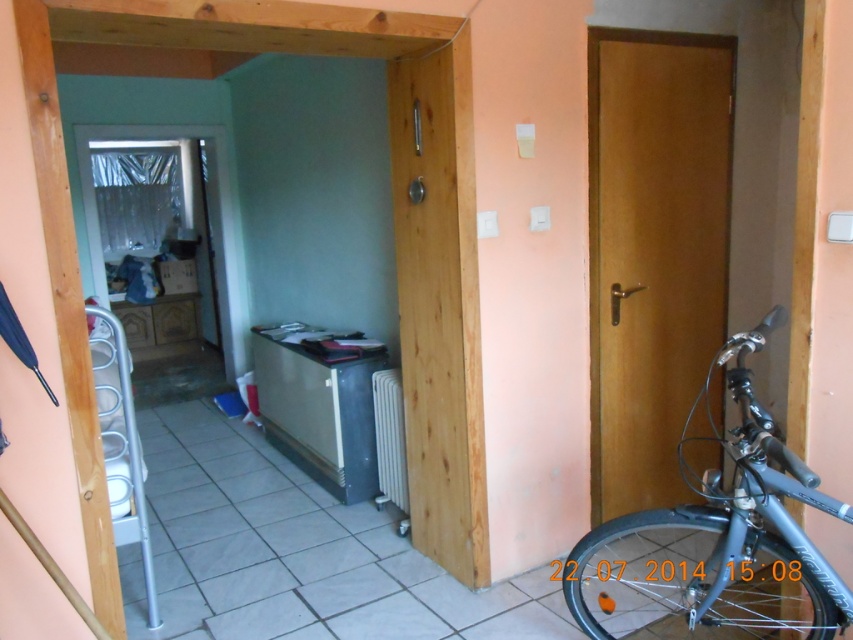
Question: Which object appears farthest from the camera in this image?

Choices:
 (A) wooden door at center
 (B) wooden door at right
 (C) silver metallic bicycle at right

Answer: (B)

Question: Is wooden door at right thinner than wooden door at center?

Choices:
 (A) yes
 (B) no

Answer: (B)

Question: Which object appears farthest from the camera in this image?

Choices:
 (A) wooden door at center
 (B) wooden door at right
 (C) silver metallic bicycle at right

Answer: (B)

Question: Does wooden door at right have a smaller size compared to wooden door at center?

Choices:
 (A) yes
 (B) no

Answer: (B)

Question: Where is wooden door at right located in relation to wooden door at center in the image?

Choices:
 (A) below
 (B) above

Answer: (B)

Question: Which point is farther from the camera taking this photo?

Choices:
 (A) (454, 113)
 (B) (662, 81)
 (C) (759, 508)

Answer: (B)